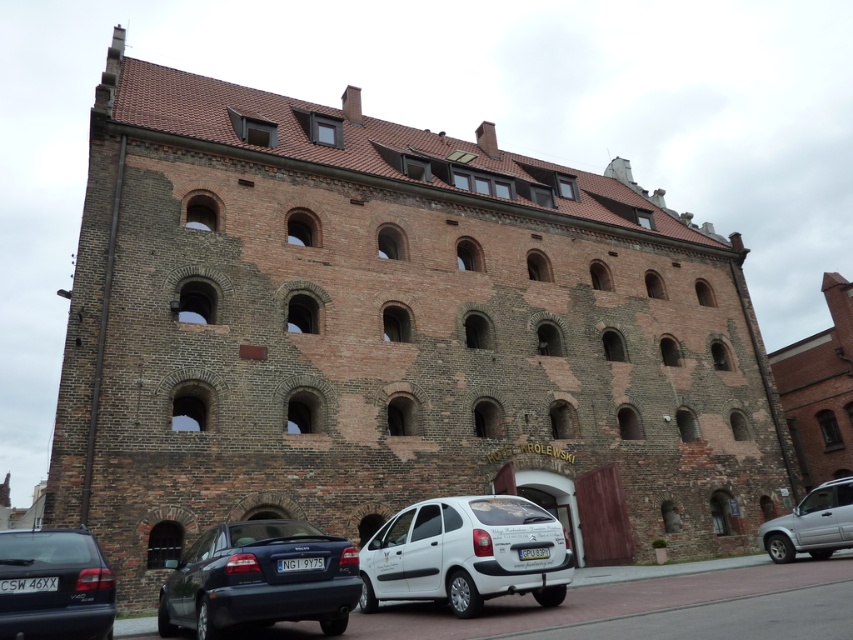
Is white matte hatchback at center thinner than silver metallic suv at lower right?

No.

Which is in front, point (494, 525) or point (811, 528)?

Positioned in front is point (494, 525).

Between point (387, 538) and point (775, 518), which one is positioned in front?

Positioned in front is point (387, 538).

You are a GUI agent. You are given a task and a screenshot of the screen. Output one action in this format:
    pyautogui.click(x=<x>, y=<y>)
    Task: Click on the white matte hatchback at center
    Image resolution: width=853 pixels, height=640 pixels.
    Given the screenshot: What is the action you would take?
    pyautogui.click(x=466, y=554)

What are the coordinates of `white matte hatchback at center` in the screenshot? It's located at (466, 554).

Does white matte hatchback at center have a greater height compared to matte black sedan at lower left?

Yes, white matte hatchback at center is taller than matte black sedan at lower left.

This screenshot has width=853, height=640. In order to click on white matte hatchback at center in this screenshot , I will do `click(466, 554)`.

Is white matte hatchback at center taller than matte black car at lower left?

Yes.

Between white matte hatchback at center and matte black car at lower left, which one appears on the right side from the viewer's perspective?

white matte hatchback at center is more to the right.

Who is more distant from viewer, (x=402, y=554) or (x=82, y=634)?

The point (x=402, y=554) is more distant.

You are a GUI agent. You are given a task and a screenshot of the screen. Output one action in this format:
    pyautogui.click(x=<x>, y=<y>)
    Task: Click on the white matte hatchback at center
    
    Given the screenshot: What is the action you would take?
    pyautogui.click(x=466, y=554)